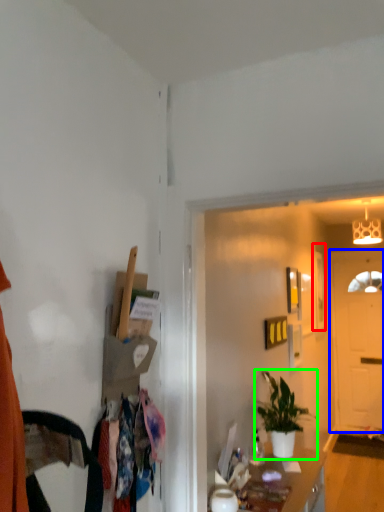
Question: Which object is positioned farthest from picture frame (highlighted by a red box)? Select from door (highlighted by a blue box) and houseplant (highlighted by a green box).

Choices:
 (A) door
 (B) houseplant

Answer: (B)